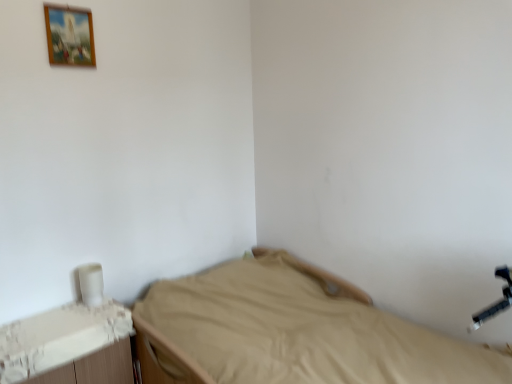
Question: Is point (70, 28) closer or farther from the camera than point (318, 380)?

Choices:
 (A) farther
 (B) closer

Answer: (A)

Question: From a real-world perspective, relative to beige fabric bed at center, is wooden picture frame at upper left vertically above or below?

Choices:
 (A) above
 (B) below

Answer: (A)

Question: Estimate the real-world distances between objects in this image. Which object is farther from the beige fabric bed at center?

Choices:
 (A) white plastic changing table at lower left
 (B) wooden picture frame at upper left

Answer: (B)

Question: Which of these objects is positioned closest to the beige fabric bed at center?

Choices:
 (A) white plastic changing table at lower left
 (B) wooden picture frame at upper left

Answer: (A)